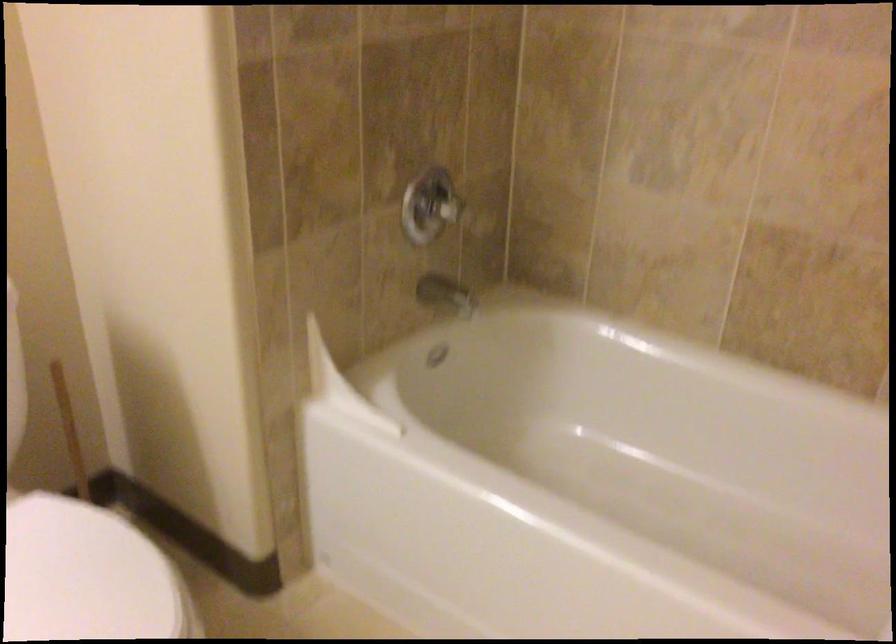
Identify the location of chrome faucet spout. This screenshot has height=644, width=896. (440, 292).